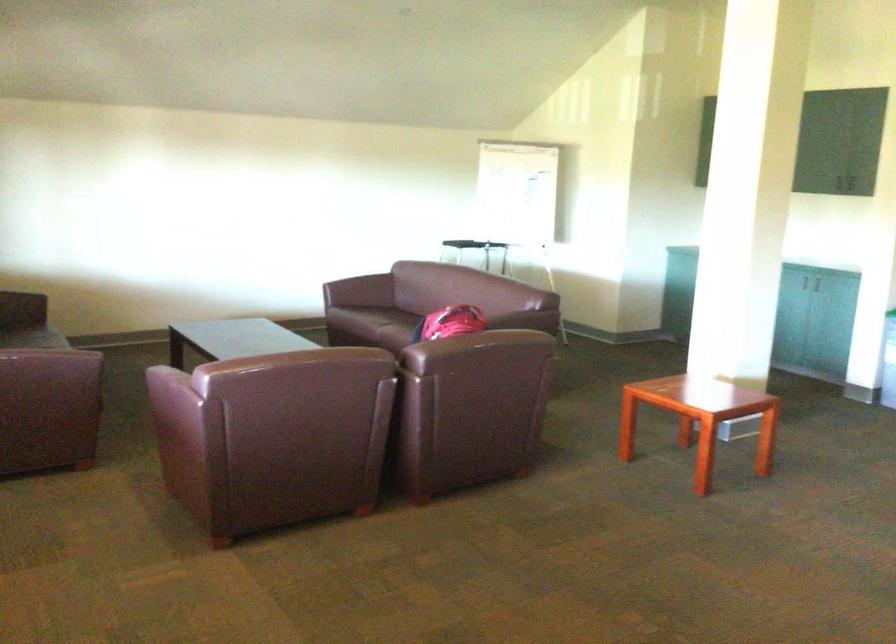
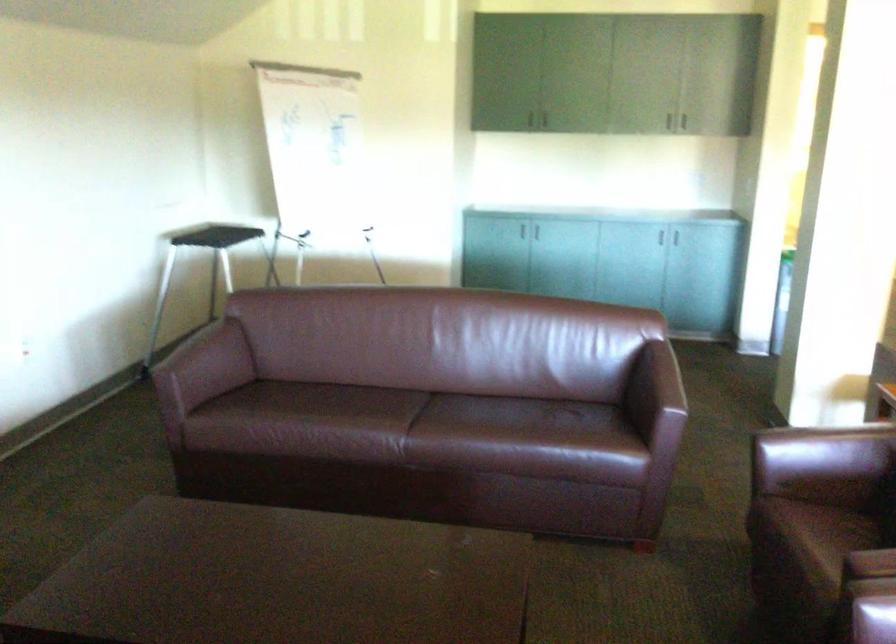
Based on the continuous images, in which direction is the camera rotating?

The rotation direction of the camera is right-down.